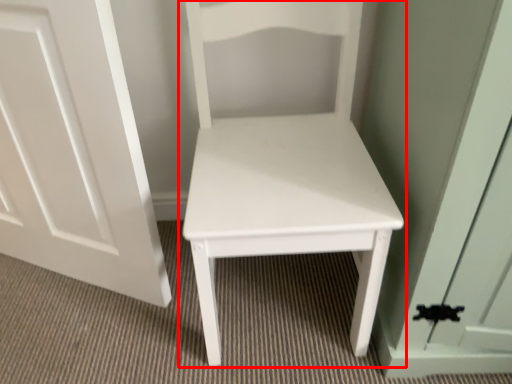
Question: Considering the relative positions of furniture (annotated by the red box) and door in the image provided, where is furniture (annotated by the red box) located with respect to the staircase?

Choices:
 (A) left
 (B) right

Answer: (B)